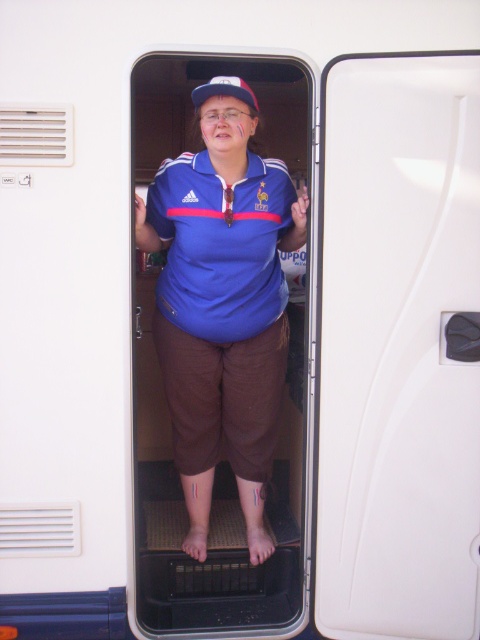
Between white plastic door at center and blue fabric baseball cap at center, which one appears on the right side from the viewer's perspective?

From the viewer's perspective, white plastic door at center appears more on the right side.

In the scene shown: Does white plastic door at center have a greater width compared to blue fabric baseball cap at center?

Yes, white plastic door at center is wider than blue fabric baseball cap at center.

What do you see at coordinates (397, 348) in the screenshot?
I see `white plastic door at center` at bounding box center [397, 348].

Locate an element on the screen. white plastic door at center is located at coordinates coord(397,348).

Can you confirm if blue fabric shirt at center is shorter than blue fabric baseball cap at center?

In fact, blue fabric shirt at center may be taller than blue fabric baseball cap at center.

Is blue fabric shirt at center bigger than blue fabric baseball cap at center?

Yes.

Is point (284, 188) farther from viewer compared to point (230, 86)?

Yes, it is.

Identify the location of blue fabric shirt at center. (223, 308).

Which is in front, point (374, 497) or point (203, 337)?

Positioned in front is point (374, 497).

Between white plastic door at center and blue fabric shirt at center, which one appears on the left side from the viewer's perspective?

From the viewer's perspective, blue fabric shirt at center appears more on the left side.

The image size is (480, 640). Find the location of `white plastic door at center`. white plastic door at center is located at coordinates [x=397, y=348].